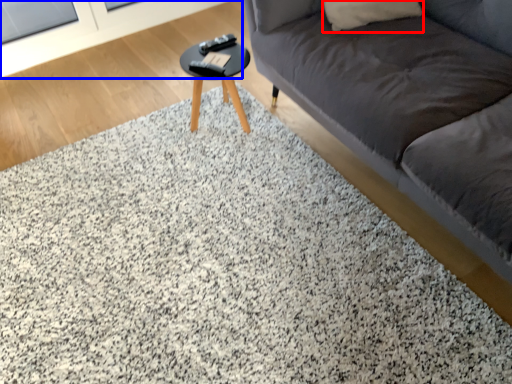
Question: Which point is further to the camera, pillow (highlighted by a red box) or screen door (highlighted by a blue box)?

Choices:
 (A) pillow
 (B) screen door

Answer: (B)